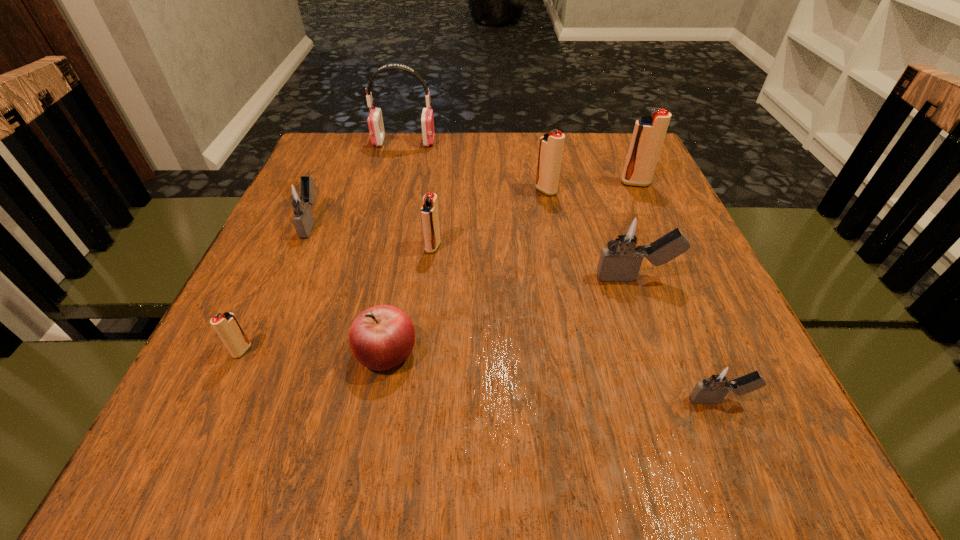
The width and height of the screenshot is (960, 540). What are the coordinates of `free location located 0.220m on the left of the fourth nearest object` in the screenshot? It's located at (478, 278).

You are a GUI agent. You are given a task and a screenshot of the screen. Output one action in this format:
    pyautogui.click(x=<x>, y=<y>)
    Task: Click on the vacant region located on the right of the sixth nearest object
    This screenshot has width=960, height=540.
    Given the screenshot: What is the action you would take?
    pyautogui.click(x=505, y=222)

You are a GUI agent. You are given a task and a screenshot of the screen. Output one action in this format:
    pyautogui.click(x=<x>, y=<y>)
    Task: Click on the free region located 0.380m on the front of the third biggest red igniter
    
    Given the screenshot: What is the action you would take?
    pyautogui.click(x=411, y=443)

At what (x,y) coordinates should I click in order to perform the action: click on blank space located on the back of the apple. Please return your answer as a coordinate pair (x, y). Looking at the image, I should click on (396, 296).

What are the coordinates of `free region located on the right of the sixth farthest igniter` in the screenshot? It's located at (476, 351).

The image size is (960, 540). I want to click on free space located 0.390m on the back of the nearest igniter, so click(645, 224).

I want to click on earphone at the far edge, so click(x=375, y=120).

This screenshot has width=960, height=540. Identify the location of igniter located at the far edge. (649, 132).

Identify the location of object located at the near edge. (720, 378).

Where is `earphone at the left edge`? earphone at the left edge is located at coordinates (375, 120).